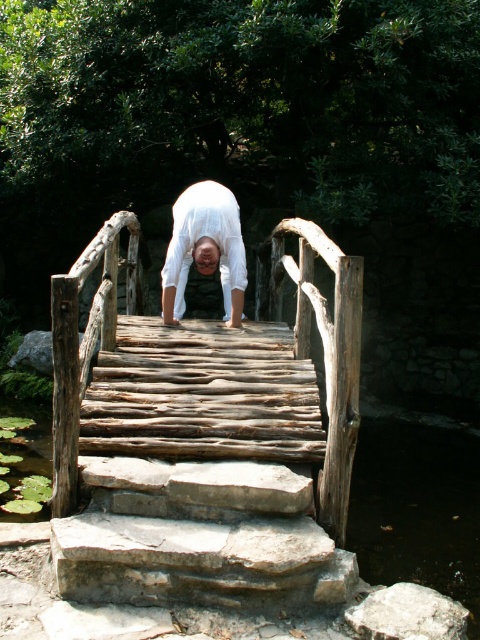
Between rustic wooden bridge at center and white matte/soft fabric at center, which one has less height?

white matte/soft fabric at center is shorter.

Does rustic wooden bridge at center appear over white matte/soft fabric at center?

No.

Does point (352, 326) come closer to viewer compared to point (213, 257)?

Yes, point (352, 326) is closer to viewer.

Find the location of a particular element. rustic wooden bridge at center is located at coordinates (248, 406).